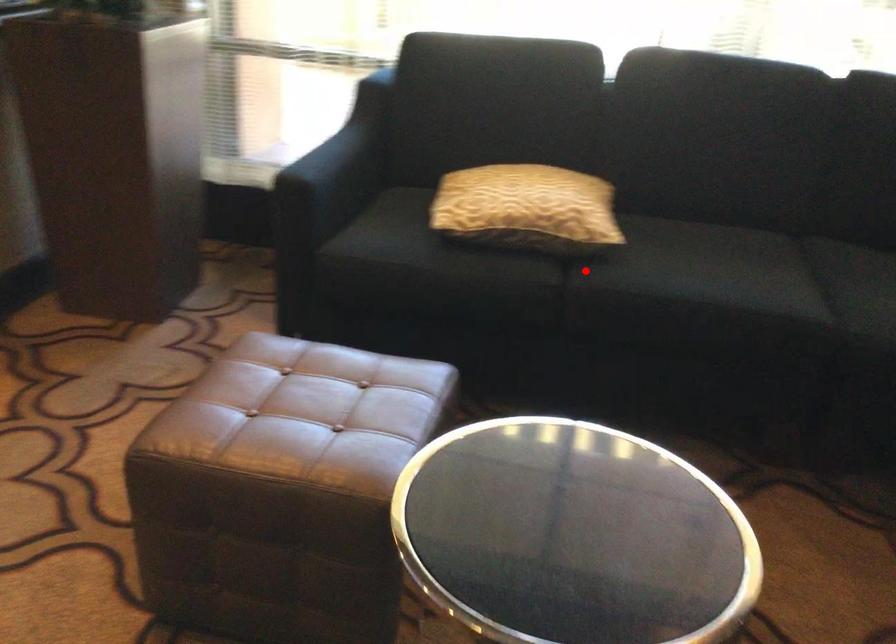
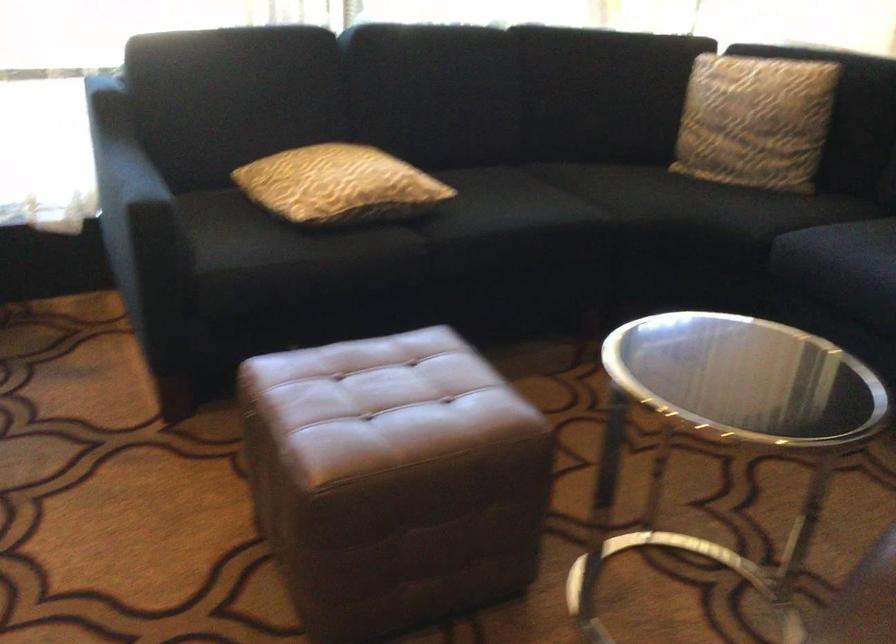
Question: I am providing you with two images of the same scene from different viewpoints. In image1, a red point is highlighted. Considering the same 3D point in image2, which of the following is correct?

Choices:
 (A) It is closer
 (B) It is farther

Answer: (B)